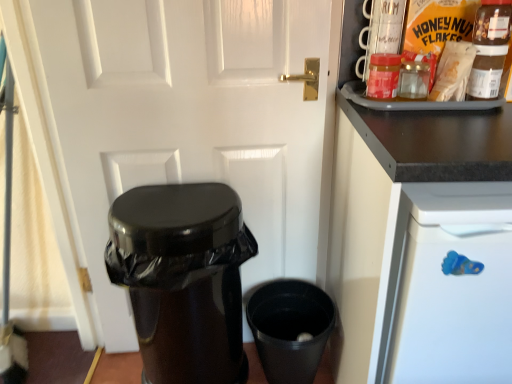
Describe the element at coordinates (453, 72) in the screenshot. I see `matte brown paper bag at upper right, acting as the 2th food starting from the back` at that location.

I want to click on black plastic cup at lower right, so click(290, 329).

The image size is (512, 384). What are the coordinates of `matte plastic honey nut flakes at upper right, positioned as the 2th food in front-to-back order` in the screenshot? It's located at (438, 24).

What do you see at coordinates (438, 24) in the screenshot?
I see `matte plastic honey nut flakes at upper right, positioned as the 2th food in front-to-back order` at bounding box center [438, 24].

Locate an element on the screen. matte brown paper bag at upper right, acting as the 2th food starting from the back is located at coordinates (453, 72).

Between black plastic cup at lower right and matte plastic jar at upper right, which one has larger width?

black plastic cup at lower right.

Is the position of black plastic cup at lower right more distant than that of matte plastic jar at upper right?

Yes, the depth of black plastic cup at lower right is greater than that of matte plastic jar at upper right.

Are black plastic cup at lower right and matte plastic jar at upper right far apart?

Actually, black plastic cup at lower right and matte plastic jar at upper right are a little close together.

Which point is more distant from viewer, (294, 381) or (394, 58)?

The point (294, 381) is more distant.

Could matte plastic jar at upper right be considered to be inside matte brown paper bag at upper right, the first food in the front-to-back sequence?

That's incorrect, matte plastic jar at upper right is not inside matte brown paper bag at upper right, the first food in the front-to-back sequence.

Who is bigger, matte brown paper bag at upper right, acting as the 2th food starting from the back, or matte plastic jar at upper right?

matte brown paper bag at upper right, acting as the 2th food starting from the back.

Does matte brown paper bag at upper right, acting as the 2th food starting from the back, turn towards matte plastic jar at upper right?

No, matte brown paper bag at upper right, acting as the 2th food starting from the back, is not facing towards matte plastic jar at upper right.

Considering the positions of objects matte brown paper bag at upper right, the first food in the front-to-back sequence, and matte plastic jar at upper right in the image provided, who is behind, matte brown paper bag at upper right, the first food in the front-to-back sequence, or matte plastic jar at upper right?

matte plastic jar at upper right is further away from the camera.

Consider the image. What's the angular difference between black plastic cup at lower right and white glossy door at center's facing directions?

0.00394 degrees separate the facing orientations of black plastic cup at lower right and white glossy door at center.

Based on the photo, is black plastic cup at lower right touching white glossy door at center?

They are not placed beside each other.

At what (x,y) coordinates should I click in order to perform the action: click on appliance to the right of white glossy door at center. Please return your answer as a coordinate pair (x, y). The width and height of the screenshot is (512, 384). Looking at the image, I should click on (290, 329).

Which is more distant, (x=293, y=327) or (x=179, y=85)?

Positioned behind is point (x=293, y=327).

Does black matte cabinet at upper right appear on the right side of white glossy door at center?

Yes, black matte cabinet at upper right is to the right of white glossy door at center.

Could you tell me if black matte cabinet at upper right is facing white glossy door at center?

No.

From the picture: Can you confirm if black matte cabinet at upper right is shorter than white glossy door at center?

Yes, black matte cabinet at upper right is shorter than white glossy door at center.

Is black matte cabinet at upper right far from matte plastic jar at upper right?

No, there isn't a large distance between black matte cabinet at upper right and matte plastic jar at upper right.

Is black matte cabinet at upper right facing towards matte plastic jar at upper right?

No, black matte cabinet at upper right is not oriented towards matte plastic jar at upper right.

Considering the relative positions of white glossy door at center and black glossy trash can at lower left in the image provided, is white glossy door at center to the left or to the right of black glossy trash can at lower left?

Clearly, white glossy door at center is on the right of black glossy trash can at lower left in the image.

Considering the sizes of objects white glossy door at center and black glossy trash can at lower left in the image provided, who is shorter, white glossy door at center or black glossy trash can at lower left?

Standing shorter between the two is black glossy trash can at lower left.

Is white glossy door at center oriented away from black glossy trash can at lower left?

Yes, white glossy door at center is facing away from black glossy trash can at lower left.

Is black matte cabinet at upper right surrounded by matte plastic honey nut flakes at upper right, positioned as the 2th food in front-to-back order?

No, matte plastic honey nut flakes at upper right, positioned as the 2th food in front-to-back order, does not contain black matte cabinet at upper right.

Is matte plastic honey nut flakes at upper right, the 1th food from the back, in front of or behind black matte cabinet at upper right in the image?

In the image, matte plastic honey nut flakes at upper right, the 1th food from the back, appears behind black matte cabinet at upper right.

Which is more to the right, matte plastic honey nut flakes at upper right, positioned as the 2th food in front-to-back order, or black matte cabinet at upper right?

Positioned to the right is black matte cabinet at upper right.

Where is `appliance below the matte plastic jar at upper right (from a real-world perspective)`? The height and width of the screenshot is (384, 512). appliance below the matte plastic jar at upper right (from a real-world perspective) is located at coordinates (290, 329).

I want to click on the 1st food to the right of the matte plastic jar at upper right, counting from the anchor's position, so click(453, 72).

Considering their positions, is matte plastic jar at upper right positioned closer to matte plastic honey nut flakes at upper right, the 1th food from the back, than black matte cabinet at upper right?

matte plastic jar at upper right is closer to matte plastic honey nut flakes at upper right, the 1th food from the back.

Based on their spatial positions, is black matte cabinet at upper right or white glossy door at center further from black glossy trash can at lower left?

Based on the image, black matte cabinet at upper right appears to be further to black glossy trash can at lower left.

Estimate the real-world distances between objects in this image. Which object is further from black plastic cup at lower right, black matte cabinet at upper right or white glossy door at center?

black matte cabinet at upper right.

Estimate the real-world distances between objects in this image. Which object is closer to white glossy door at center, matte brown paper bag at upper right, acting as the 2th food starting from the back, or black plastic cup at lower right?

black plastic cup at lower right.

Looking at the image, which one is located further to matte plastic jar at upper right, black glossy trash can at lower left or matte brown paper bag at upper right, acting as the 2th food starting from the back?

black glossy trash can at lower left.

When comparing their distances from black matte cabinet at upper right, does black plastic cup at lower right or matte plastic honey nut flakes at upper right, the 1th food from the back, seem further?

Among the two, black plastic cup at lower right is located further to black matte cabinet at upper right.

Considering their positions, is black glossy trash can at lower left positioned further to matte brown paper bag at upper right, the first food in the front-to-back sequence, than black matte cabinet at upper right?

black glossy trash can at lower left.

Which object lies further to the anchor point black glossy trash can at lower left, white glossy door at center or black matte cabinet at upper right?

black matte cabinet at upper right.

You are a GUI agent. You are given a task and a screenshot of the screen. Output one action in this format:
    pyautogui.click(x=<x>, y=<y>)
    Task: Click on the appliance between black glossy trash can at lower left and black matte cabinet at upper right
    Image resolution: width=512 pixels, height=384 pixels.
    Given the screenshot: What is the action you would take?
    pyautogui.click(x=290, y=329)

The height and width of the screenshot is (384, 512). Find the location of `bottle between matte plastic honey nut flakes at upper right, positioned as the 2th food in front-to-back order, and black matte cabinet at upper right in the up-down direction`. bottle between matte plastic honey nut flakes at upper right, positioned as the 2th food in front-to-back order, and black matte cabinet at upper right in the up-down direction is located at coordinates (383, 75).

You are a GUI agent. You are given a task and a screenshot of the screen. Output one action in this format:
    pyautogui.click(x=<x>, y=<y>)
    Task: Click on the cabinetry that lies between matte plastic honey nut flakes at upper right, positioned as the 2th food in front-to-back order, and black plastic cup at lower right from top to bottom
    The width and height of the screenshot is (512, 384).
    Given the screenshot: What is the action you would take?
    pyautogui.click(x=421, y=245)

Locate an element on the screen. This screenshot has width=512, height=384. food that lies between matte plastic honey nut flakes at upper right, positioned as the 2th food in front-to-back order, and black matte cabinet at upper right from top to bottom is located at coordinates [x=453, y=72].